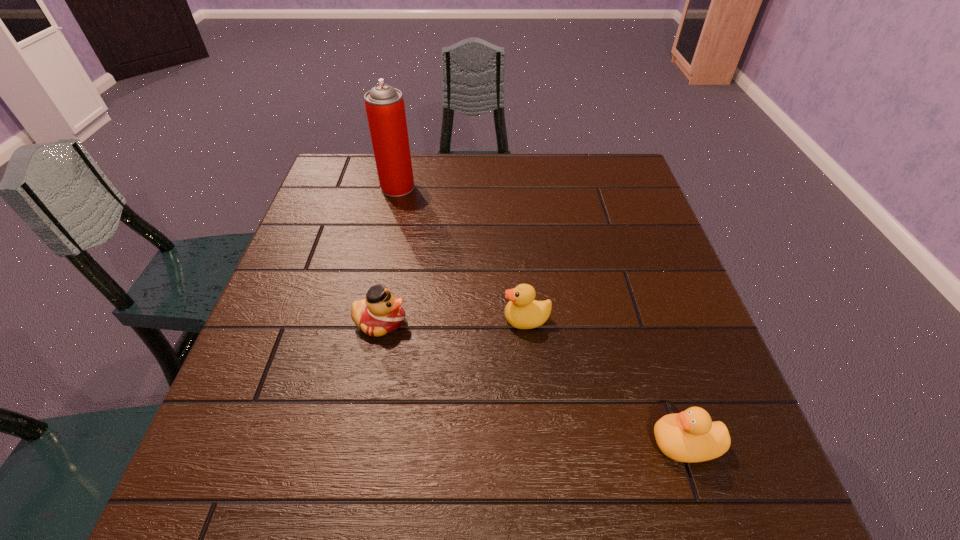
Where is `vacant space at the left edge of the desktop`? The width and height of the screenshot is (960, 540). vacant space at the left edge of the desktop is located at coordinates (323, 295).

Where is `vacant region at the right edge`? vacant region at the right edge is located at coordinates (637, 210).

Find the location of a particular element. The image size is (960, 540). free space at the far right corner of the desktop is located at coordinates (592, 163).

Locate an element on the screen. free area in between the leftmost duck and the nearest duck is located at coordinates (533, 382).

In order to click on unoccupied position between the nearest duck and the leftmost duck in this screenshot , I will do `click(533, 382)`.

You are a GUI agent. You are given a task and a screenshot of the screen. Output one action in this format:
    pyautogui.click(x=<x>, y=<y>)
    Task: Click on the free space between the leftmost duck and the second duck from right to left
    This screenshot has height=540, width=960.
    Given the screenshot: What is the action you would take?
    pyautogui.click(x=453, y=321)

I want to click on free space between the second object from right to left and the tallest object, so click(x=462, y=253).

Identify the location of blank region between the nearest duck and the second duck from left to right. (606, 381).

At what (x,y) coordinates should I click in order to perform the action: click on free area in between the nearest object and the leftmost duck. Please return your answer as a coordinate pair (x, y). The width and height of the screenshot is (960, 540). Looking at the image, I should click on (533, 382).

The image size is (960, 540). In order to click on vacant region between the third object from left to right and the nearest object in this screenshot , I will do `click(606, 381)`.